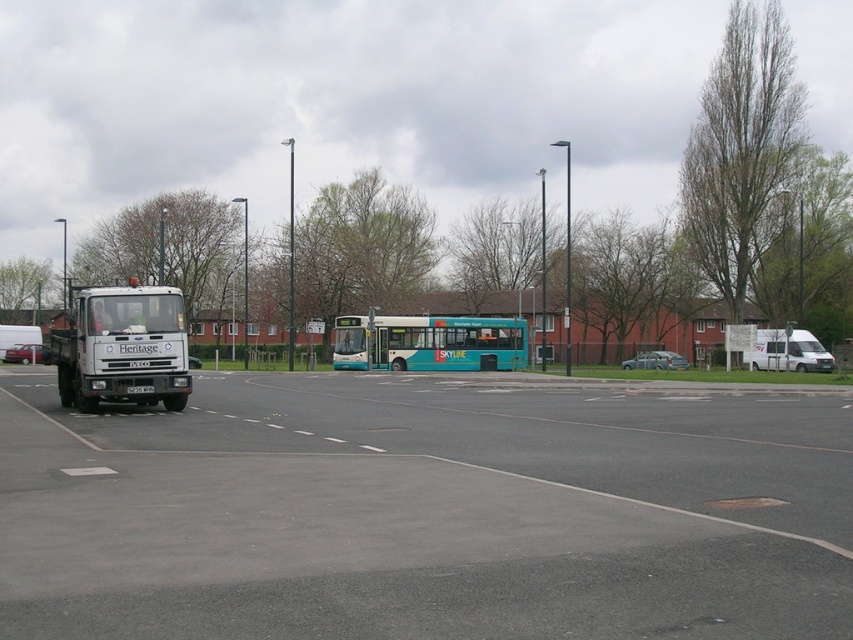
At what (x,y) coordinates should I click in order to perform the action: click on white matte truck at left. Please return your answer as a coordinate pair (x, y). The height and width of the screenshot is (640, 853). Looking at the image, I should click on (123, 348).

Which of these two, white matte truck at left or teal matte bus at center, stands taller?

Standing taller between the two is white matte truck at left.

Describe the element at coordinates (123, 348) in the screenshot. I see `white matte truck at left` at that location.

This screenshot has width=853, height=640. I want to click on white matte truck at left, so click(x=123, y=348).

Between white matte van at right and metallic silver car at left, which one appears on the right side from the viewer's perspective?

white matte van at right

This screenshot has width=853, height=640. What do you see at coordinates (780, 349) in the screenshot?
I see `white matte van at right` at bounding box center [780, 349].

Where is `white matte van at right`? white matte van at right is located at coordinates [780, 349].

Locate an element on the screen. The height and width of the screenshot is (640, 853). white matte van at right is located at coordinates (780, 349).

Does point (815, 580) come closer to viewer compared to point (816, 344)?

That is True.

Does gray asphalt parking lot at lower left have a lesser height compared to white matte van at right?

Yes.

Who is more distant from viewer, (167,419) or (776,358)?

The point (776,358) is more distant.

The image size is (853, 640). Identify the location of gray asphalt parking lot at lower left. (426, 509).